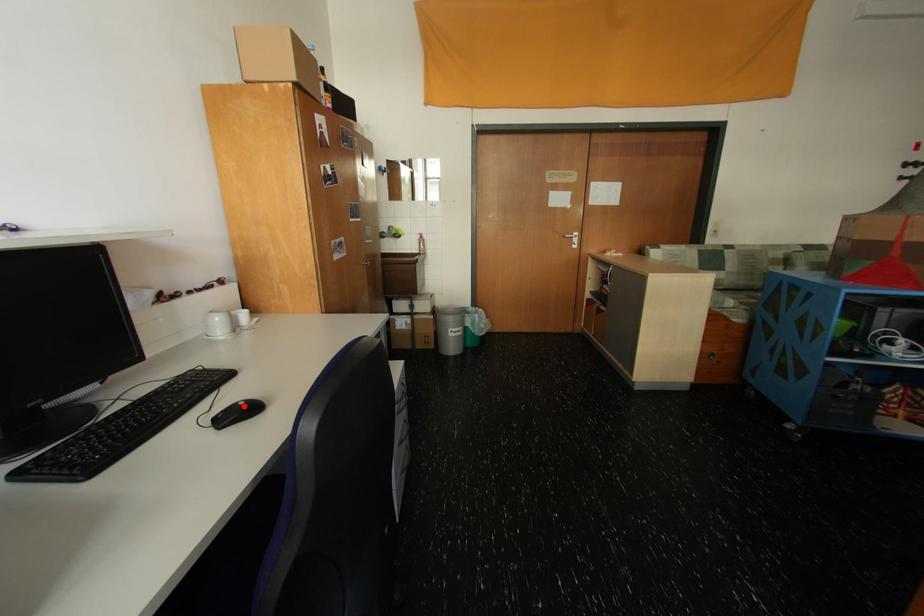
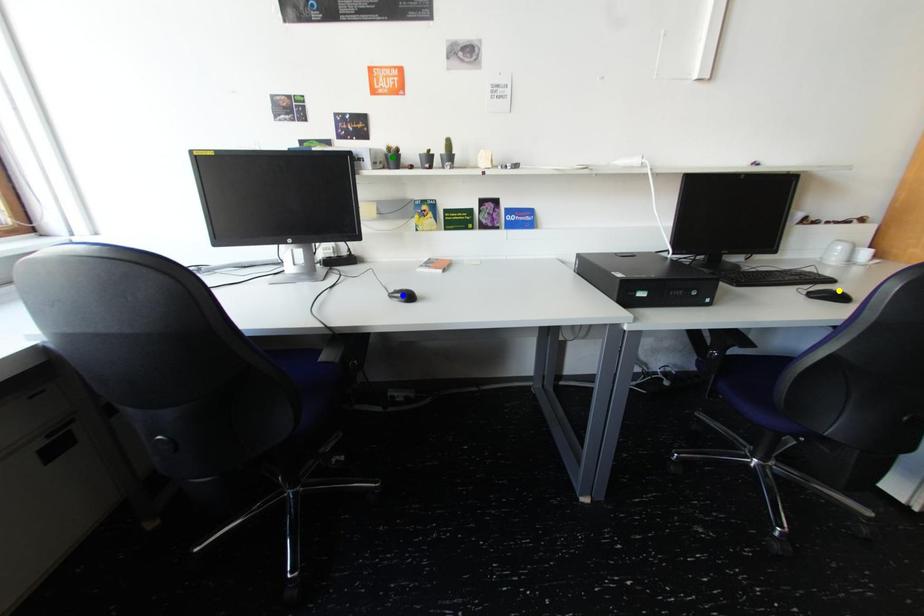
Question: I am providing you with two images of the same scene from different viewpoints. A red point is marked on the first image. You are given multiple points on the second image. Can you choose the point in image 2 that corresponds to the point in image 1?

Choices:
 (A) yellow point
 (B) blue point
 (C) green point

Answer: (A)